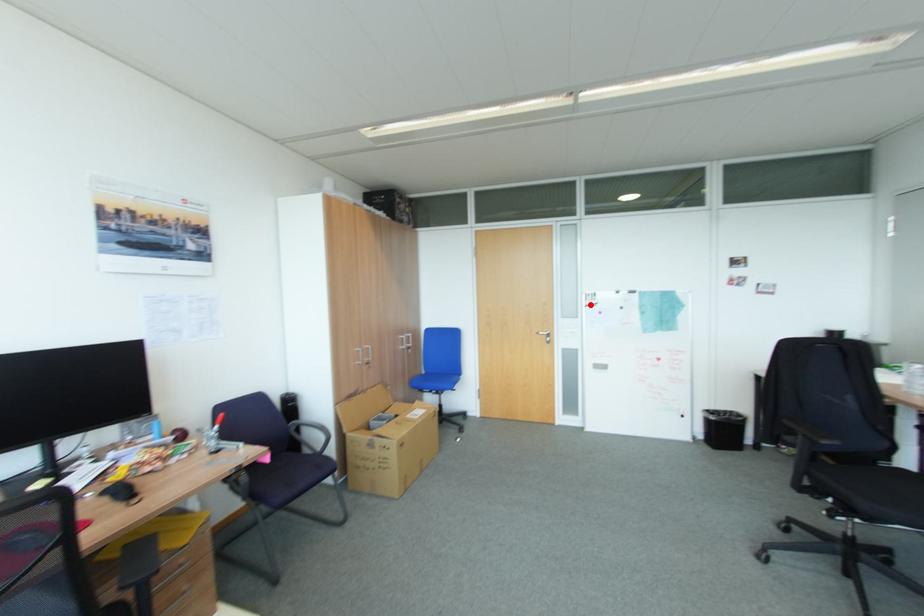
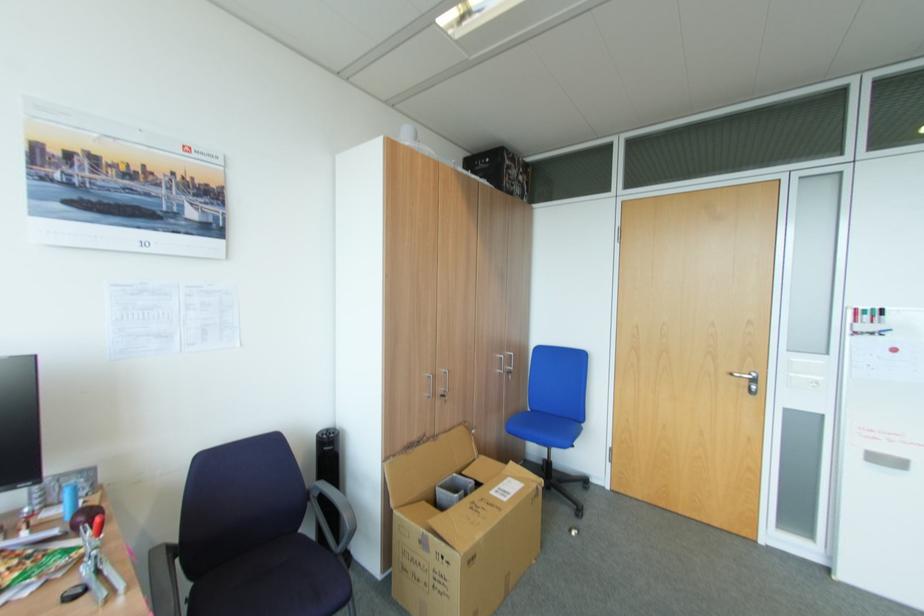
Locate, in the second image, the point that corresponds to the highlighted location in the first image.

(856, 333)